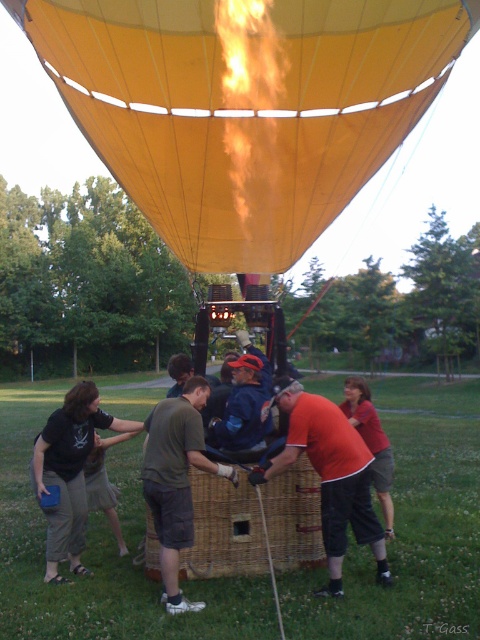
This screenshot has height=640, width=480. What do you see at coordinates (204, 129) in the screenshot?
I see `yellow fabric balloon at upper center` at bounding box center [204, 129].

In the scene shown: Between yellow fabric balloon at upper center and dark green fabric shirt at center, which one has more height?

Standing taller between the two is yellow fabric balloon at upper center.

The width and height of the screenshot is (480, 640). What are the coordinates of `yellow fabric balloon at upper center` in the screenshot? It's located at (204, 129).

Between red-orange shirt at lower center and dark green fabric shirt at center, which one is positioned higher?

red-orange shirt at lower center is higher up.

Can you confirm if red-orange shirt at lower center is positioned to the left of dark green fabric shirt at center?

In fact, red-orange shirt at lower center is to the right of dark green fabric shirt at center.

Is point (382, 531) positioned after point (207, 388)?

No, (382, 531) is closer to viewer.

Image resolution: width=480 pixels, height=640 pixels. Identify the location of red-orange shirt at lower center. (330, 476).

Is dark green fabric shirt at center wider than blue denim jacket at center?

→ Indeed, dark green fabric shirt at center has a greater width compared to blue denim jacket at center.

Is point (159, 429) more distant than point (256, 401)?

No, it is not.

Does point (199, 451) lie behind point (259, 448)?

No, (199, 451) is closer to viewer.

The image size is (480, 640). In order to click on dark green fabric shirt at center in this screenshot , I will do `click(176, 481)`.